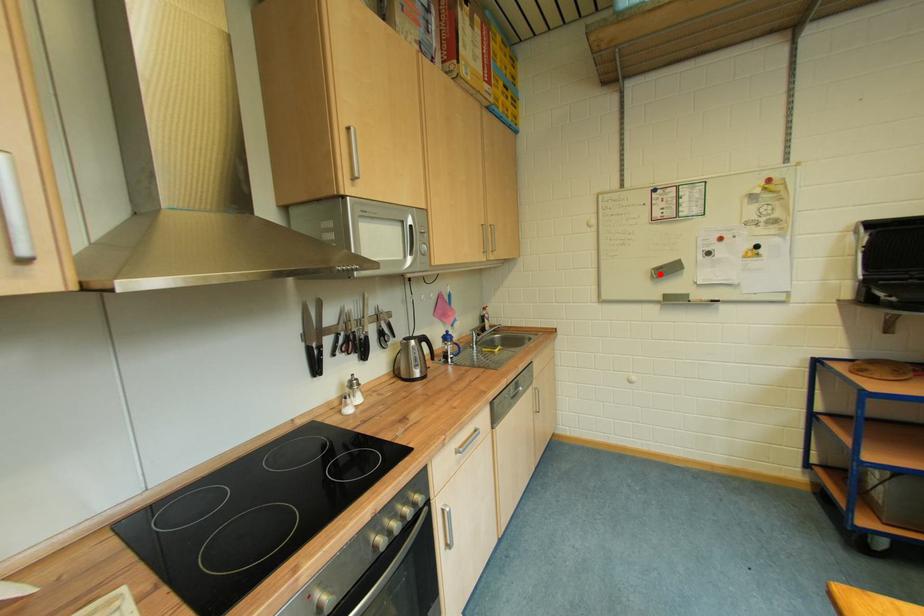
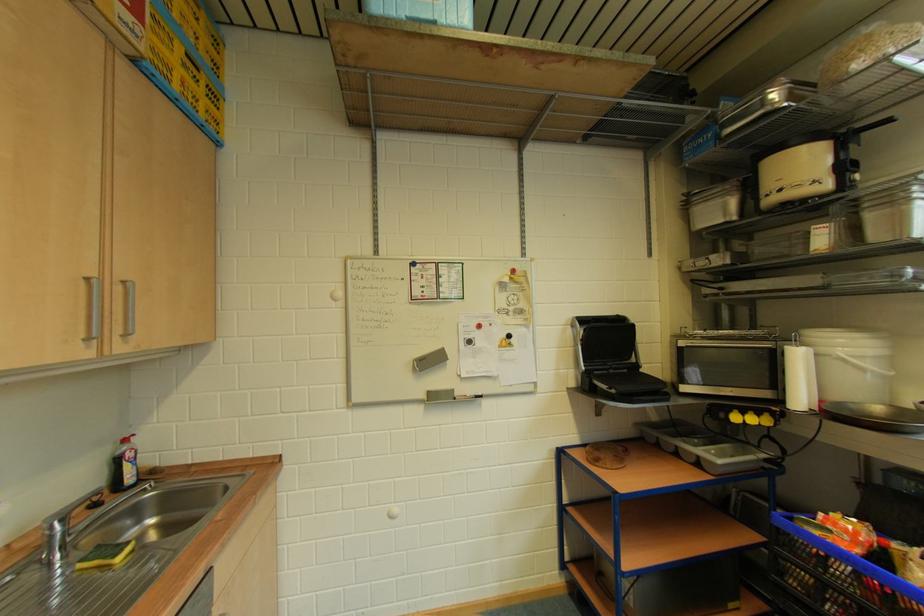
The point at the highlighted location is marked in the first image. Where is the corresponding point in the second image?

(421, 365)